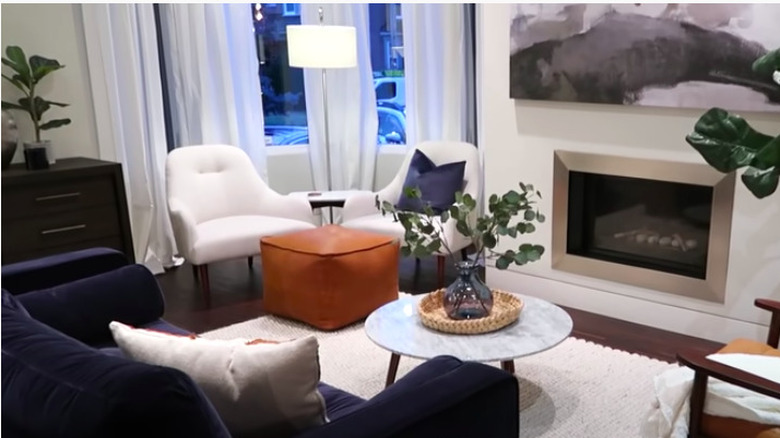
The image size is (780, 438). In order to click on wall art in this screenshot , I will do `click(635, 67)`.